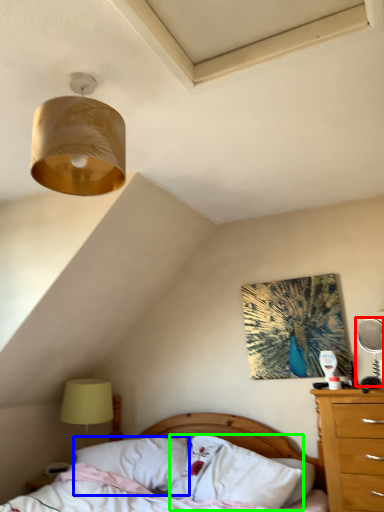
Question: Which is farther away from mechanical fan (highlighted by a red box)? pillow (highlighted by a blue box) or pillow (highlighted by a green box)?

Choices:
 (A) pillow
 (B) pillow

Answer: (A)